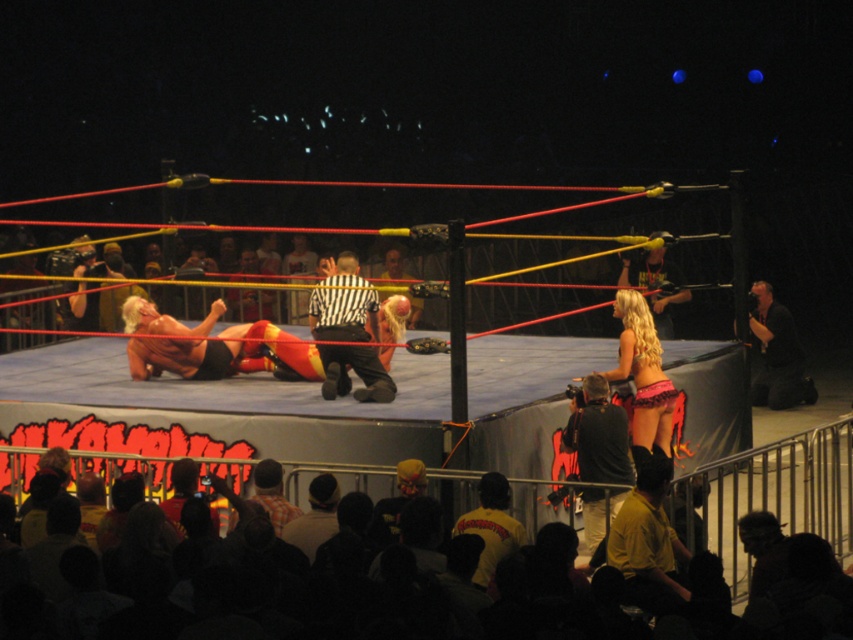
You are a photographer at the wrestling event and need to quickly grab an item to capture a closeup shot. You have the black leather camera at lower right and the pink fabric bikini at center. Which item is more suitable for taking a photo?

The black leather camera at lower right is more suitable for taking a photo since it is the actual camera, whereas the pink fabric bikini at center is an article of clothing worn by a wrestler and not a photography tool.

You are a photographer at the live event and want to capture a closeup of the yellow shirt at lower right. Based on its coordinates, where should you aim your camera?

The yellow shirt at lower right is located at point [647,540], so aim your camera there to capture it.

In the scene shown: You are a photographer at the wrestling event. You need to take a photo of the black and white striped shirt at center and the black leather camera at lower right. Which object should you focus on first if you want to capture both in the same frame without moving the camera?

The black and white striped shirt at center is not as tall as the black leather camera at lower right, so you should focus on the black and white striped shirt at center first to ensure it is in focus before the taller black leather camera at lower right.